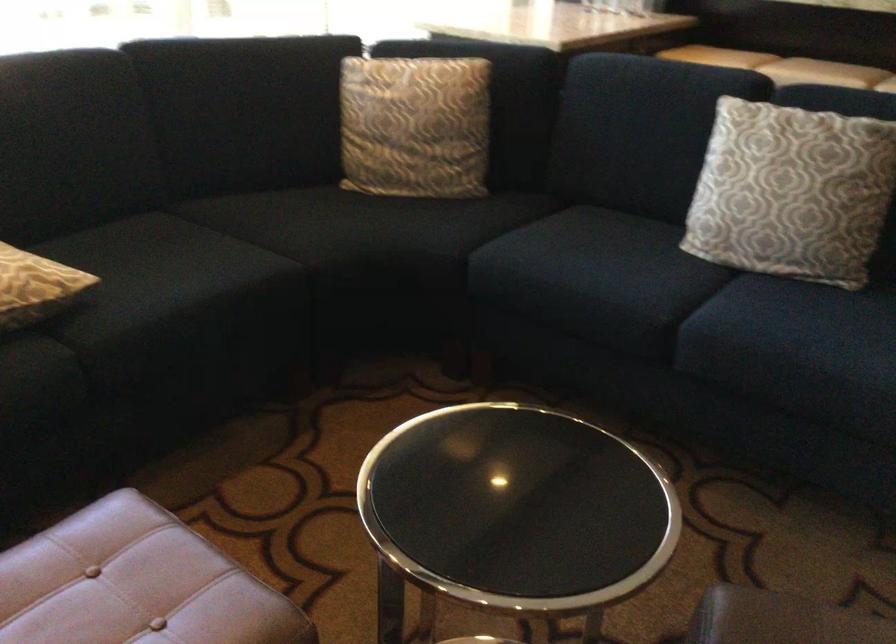
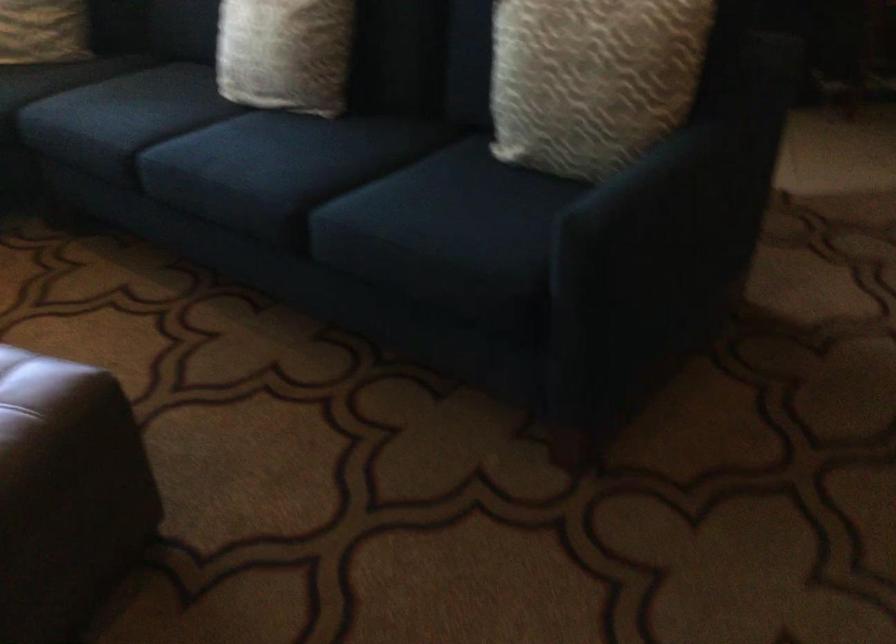
Find the pixel in the second image that matches the point at 822,341 in the first image.

(245, 154)